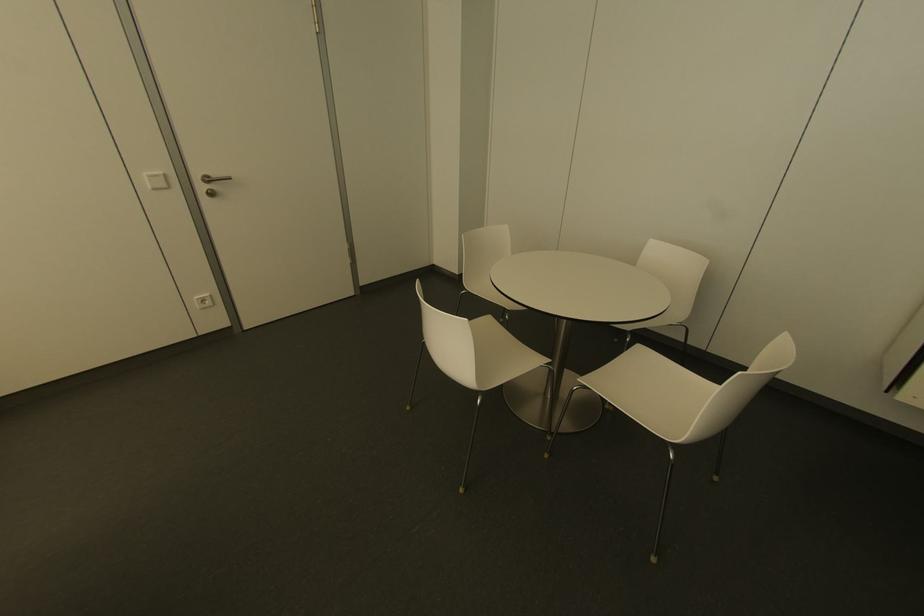
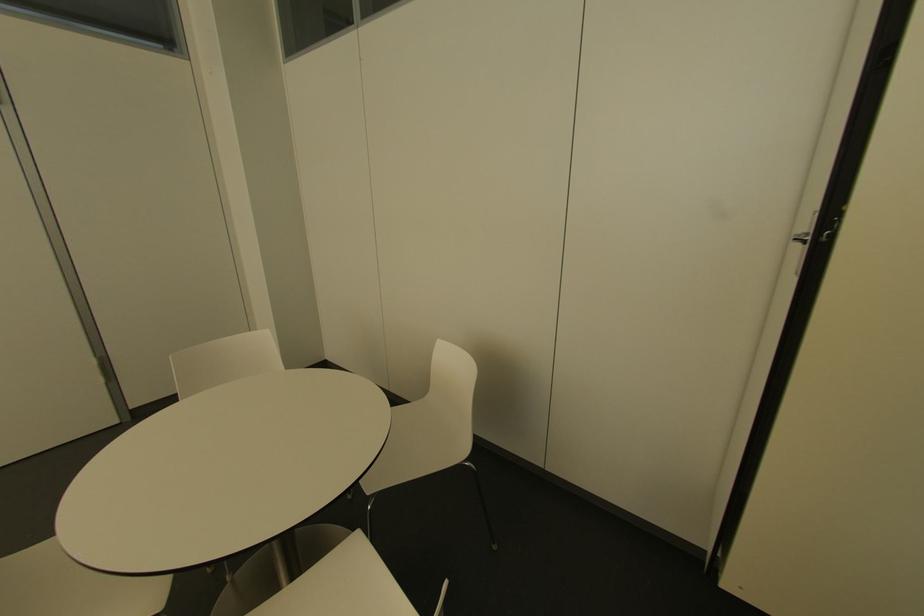
Which direction would the cameraman need to move to produce the second image?

The cameraman moved toward right, forward.